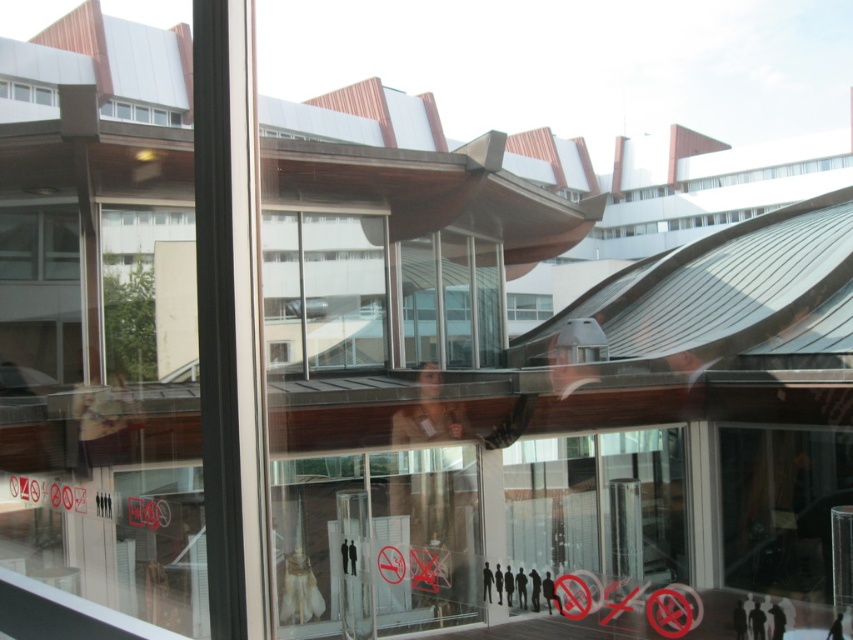
You are standing inside a room and want to look outside through the transparent glass door at center and the clear glass window at upper left. Which one allows you to see further into the distance?

The transparent glass door at center is in front of the clear glass window at upper left, so the clear glass window at upper left is farther away and allows you to see further into the distance.